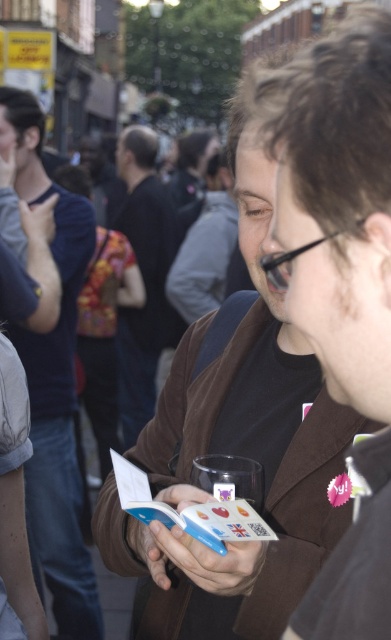
Is matte brown jacket at left positioned in front of floral fabric purse at center?

Yes.

Between point (57, 538) and point (102, 406), which one is positioned in front?

Point (57, 538)

Where is `matte brown jacket at left`? matte brown jacket at left is located at coordinates (53, 385).

Does matte brown jacket at left have a smaller size compared to dark brown leather jacket at center?

Yes, matte brown jacket at left is smaller than dark brown leather jacket at center.

Between matte brown jacket at left and dark brown leather jacket at center, which one has more height?

Standing taller between the two is dark brown leather jacket at center.

Which is in front, point (37, 576) or point (132, 214)?

Point (37, 576) is in front.

I want to click on matte brown jacket at left, so pyautogui.click(x=53, y=385).

Who is lower down, dark brown leather jacket at center or floral fabric purse at center?

floral fabric purse at center is lower down.

Can you confirm if dark brown leather jacket at center is positioned to the right of floral fabric purse at center?

Correct, you'll find dark brown leather jacket at center to the right of floral fabric purse at center.

Between point (159, 282) and point (87, 324), which one is positioned in front?

Positioned in front is point (87, 324).

Find the location of a particular element. The height and width of the screenshot is (640, 391). dark brown leather jacket at center is located at coordinates (143, 276).